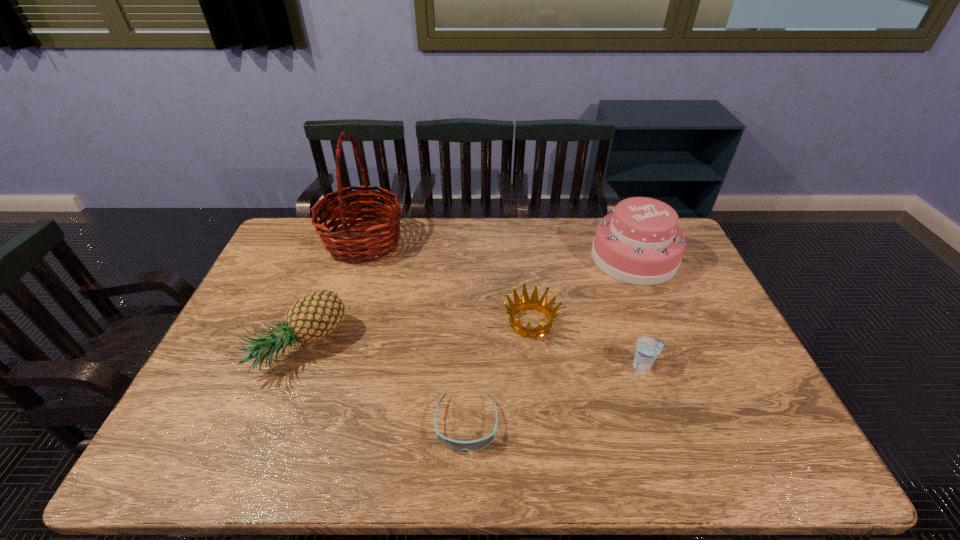
The image size is (960, 540). Find the location of `blank space at the far edge of the desktop`. blank space at the far edge of the desktop is located at coordinates (503, 220).

In order to click on vacant space at the near edge of the desktop in this screenshot , I will do `click(493, 450)`.

In the image, there is a desktop. Identify the location of vacant region at the left edge. (226, 355).

Locate an element on the screen. vacant space at the right edge is located at coordinates (719, 342).

This screenshot has height=540, width=960. Find the location of `vacant region at the near right corner of the desktop`. vacant region at the near right corner of the desktop is located at coordinates (755, 446).

Find the location of a particular element. The image size is (960, 540). empty space between the yogurt and the cake is located at coordinates (638, 312).

Where is `unoccupied position between the goggles and the tallest object`? unoccupied position between the goggles and the tallest object is located at coordinates (415, 333).

Find the location of a particular element. Image resolution: width=960 pixels, height=540 pixels. free spot between the fourth object from left to right and the tallest object is located at coordinates (447, 282).

Where is `vacant region between the goggles and the fourth shortest object`? The image size is (960, 540). vacant region between the goggles and the fourth shortest object is located at coordinates (383, 386).

What are the coordinates of `free space that is in between the basket and the second tallest object` in the screenshot? It's located at (498, 250).